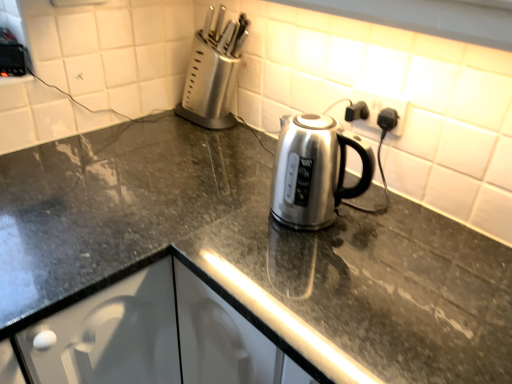
Where is `free space in front of satin silver knife block at upper left`? The height and width of the screenshot is (384, 512). free space in front of satin silver knife block at upper left is located at coordinates [199, 145].